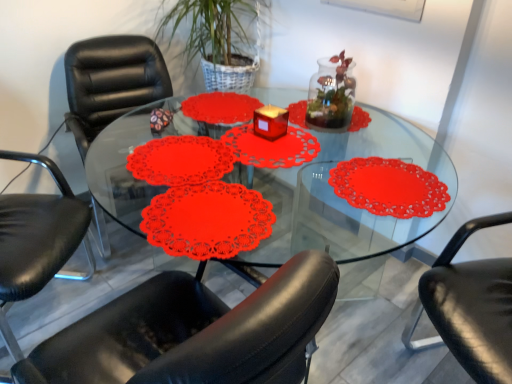
Locate an element on the screen. vacant region to the left of transparent glass terrarium at center is located at coordinates (289, 132).